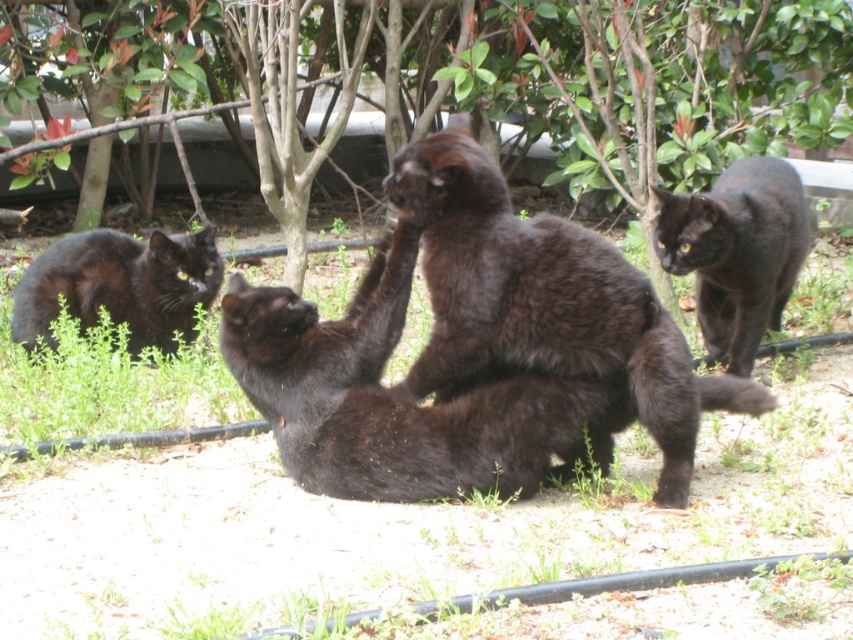
You are observing two matte black cats in a garden. The first is the matte black cat at upper right and the second is the matte black cat at left. Which of these two cats is located more to the right side of the scene?

The matte black cat at upper right is positioned on the right side of the matte black cat at left, so it is located more to the right in the scene.

You are a photographer trying to capture a photo of both the matte black cat at upper right and the matte black cat at left. Which cat should you focus on first to ensure both are in sharp focus?

You should focus on the matte black cat at upper right first because it is closer to you than the matte black cat at left. By focusing on the closer cat, the farther one will also be in focus due to the depth of field.

Based on the scene description, if you were to draw a vertical line from the top edge of the image straight down, which cat would be closer to the bottom edge? The shiny dark brown cat at center or the matte black cat at left?

The shiny dark brown cat at center is located below the matte black cat at left, so the shiny dark brown cat at center would be closer to the bottom edge.